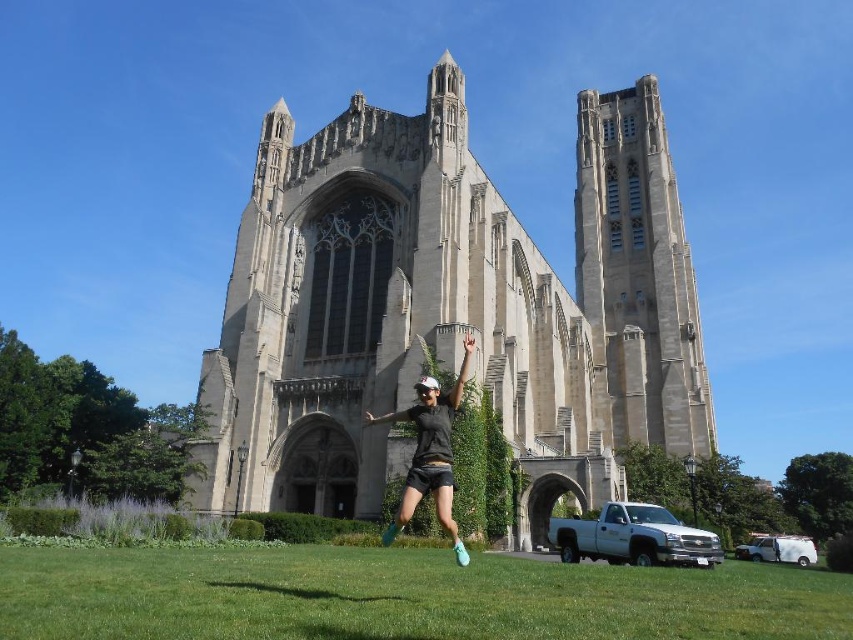
You are a GUI agent. You are given a task and a screenshot of the screen. Output one action in this format:
    pyautogui.click(x=<x>, y=<y>)
    Task: Click on the stone church at center
    This screenshot has width=853, height=640.
    Given the screenshot: What is the action you would take?
    [x=448, y=308]

Can you confirm if stone church at center is positioned above black matte shorts at center?

Yes, stone church at center is above black matte shorts at center.

I want to click on stone church at center, so click(x=448, y=308).